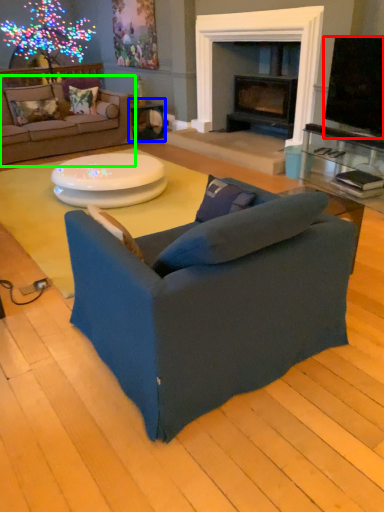
Question: Which object is positioned farthest from television (highlighted by a red box)? Select from table (highlighted by a blue box) and studio couch (highlighted by a green box).

Choices:
 (A) table
 (B) studio couch

Answer: (B)